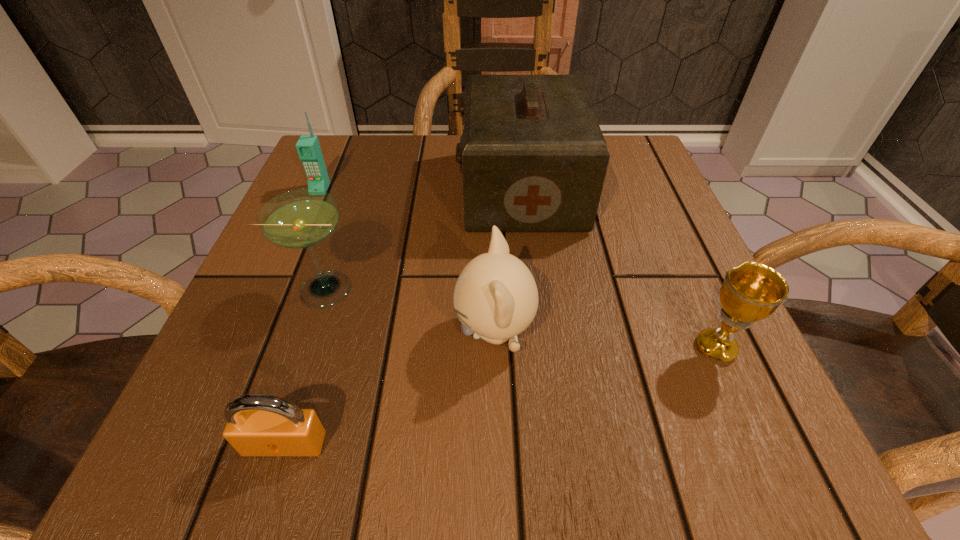
This screenshot has height=540, width=960. What are the coordinates of `the first-aid kit situated at the right edge` in the screenshot? It's located at (533, 157).

This screenshot has height=540, width=960. Identify the location of chalice located at the right edge. (751, 292).

You are a GUI agent. You are given a task and a screenshot of the screen. Output one action in this format:
    pyautogui.click(x=<x>, y=<y>)
    Task: Click on the object positioned at the far left corner
    The width and height of the screenshot is (960, 540).
    Given the screenshot: What is the action you would take?
    pyautogui.click(x=308, y=147)

Where is `object at the near left corner`? object at the near left corner is located at coordinates (257, 424).

Where is `object at the far right corner`? Image resolution: width=960 pixels, height=540 pixels. object at the far right corner is located at coordinates (533, 157).

In the image, there is a desktop. Where is `vacant space at the far edge`? Image resolution: width=960 pixels, height=540 pixels. vacant space at the far edge is located at coordinates (406, 140).

What are the coordinates of `free location at the near edge of the desktop` in the screenshot? It's located at (576, 447).

This screenshot has height=540, width=960. In the image, there is a desktop. In order to click on vacant space at the left edge in this screenshot , I will do `click(280, 321)`.

Where is `vacant space at the right edge of the desktop`? This screenshot has height=540, width=960. vacant space at the right edge of the desktop is located at coordinates (699, 313).

The width and height of the screenshot is (960, 540). What are the coordinates of `free region at the far left corner` in the screenshot? It's located at (344, 152).